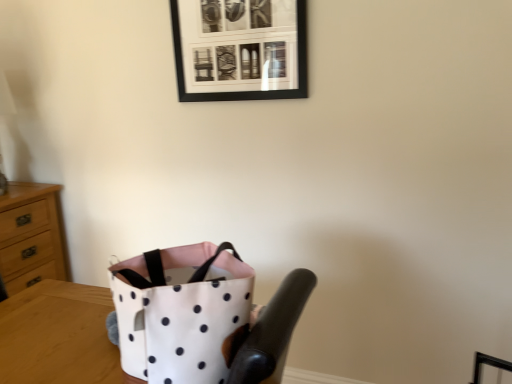
Question: Is wooden chest of drawers at left taller than black matte picture frame at upper center?

Choices:
 (A) yes
 (B) no

Answer: (A)

Question: Considering the relative sizes of wooden chest of drawers at left and black matte picture frame at upper center in the image provided, is wooden chest of drawers at left shorter than black matte picture frame at upper center?

Choices:
 (A) no
 (B) yes

Answer: (A)

Question: From the image's perspective, is wooden chest of drawers at left located above black matte picture frame at upper center?

Choices:
 (A) yes
 (B) no

Answer: (B)

Question: From the image's perspective, is wooden chest of drawers at left beneath black matte picture frame at upper center?

Choices:
 (A) yes
 (B) no

Answer: (A)

Question: Does wooden chest of drawers at left appear on the right side of black matte picture frame at upper center?

Choices:
 (A) no
 (B) yes

Answer: (A)

Question: Can we say wooden chest of drawers at left lies outside black matte picture frame at upper center?

Choices:
 (A) no
 (B) yes

Answer: (B)

Question: Does white polka dot fabric bag at lower center turn towards wooden chest of drawers at left?

Choices:
 (A) yes
 (B) no

Answer: (B)

Question: Is white polka dot fabric bag at lower center closer to the viewer compared to wooden chest of drawers at left?

Choices:
 (A) no
 (B) yes

Answer: (B)

Question: Is wooden chest of drawers at left surrounded by white polka dot fabric bag at lower center?

Choices:
 (A) yes
 (B) no

Answer: (B)

Question: Is white polka dot fabric bag at lower center outside wooden chest of drawers at left?

Choices:
 (A) yes
 (B) no

Answer: (A)

Question: Can you confirm if white polka dot fabric bag at lower center is taller than wooden chest of drawers at left?

Choices:
 (A) no
 (B) yes

Answer: (A)

Question: Is white polka dot fabric bag at lower center bigger than wooden chest of drawers at left?

Choices:
 (A) no
 (B) yes

Answer: (A)

Question: Could you tell me if black matte picture frame at upper center is facing white fabric bag at center?

Choices:
 (A) yes
 (B) no

Answer: (B)